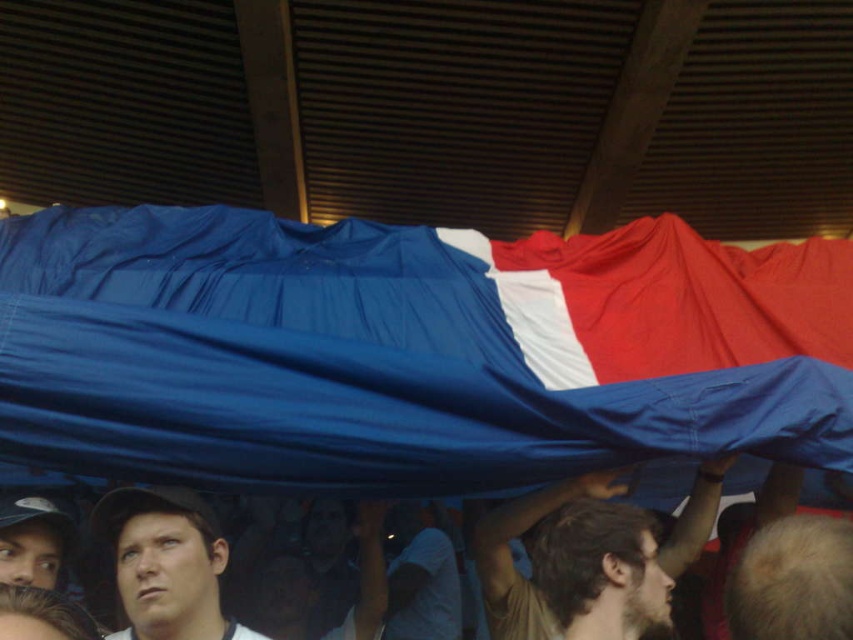
Question: From the image, what is the correct spatial relationship of matte white cap at center in relation to brown textured shirt at center?

Choices:
 (A) left
 (B) right

Answer: (A)

Question: Does brown textured shirt at center lie in front of matte black cap at lower left?

Choices:
 (A) yes
 (B) no

Answer: (B)

Question: Which object is positioned farthest from the matte white cap at center?

Choices:
 (A) matte black cap at lower left
 (B) brown textured shirt at center

Answer: (B)

Question: Which point is farther to the camera?

Choices:
 (A) (596, 472)
 (B) (120, 516)
 (C) (663, 484)
 (D) (3, 529)

Answer: (C)

Question: Which object is the farthest from the matte black cap at lower left?

Choices:
 (A) blue fabric at center
 (B) matte white cap at center

Answer: (A)

Question: Can you confirm if matte white cap at center is positioned below blue fabric at center?

Choices:
 (A) yes
 (B) no

Answer: (B)